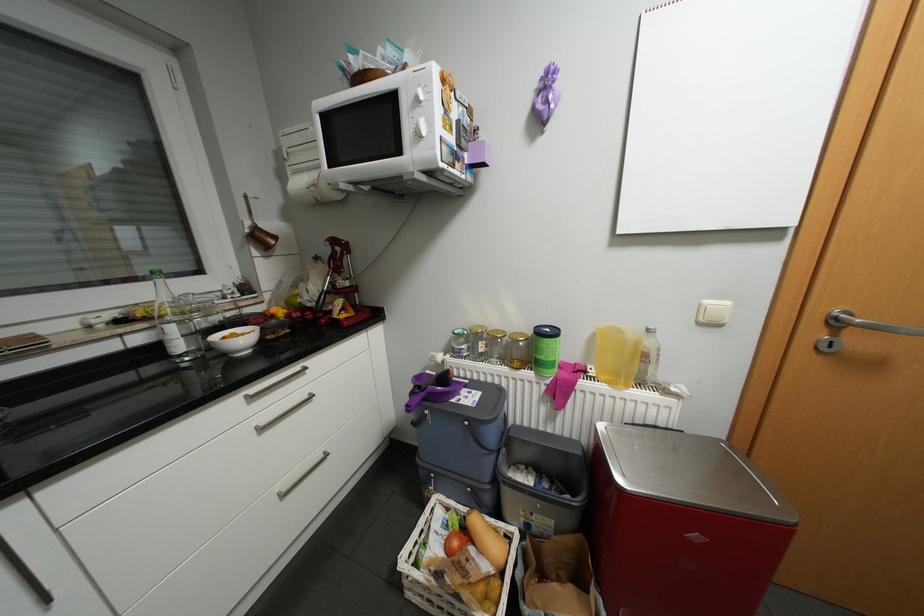
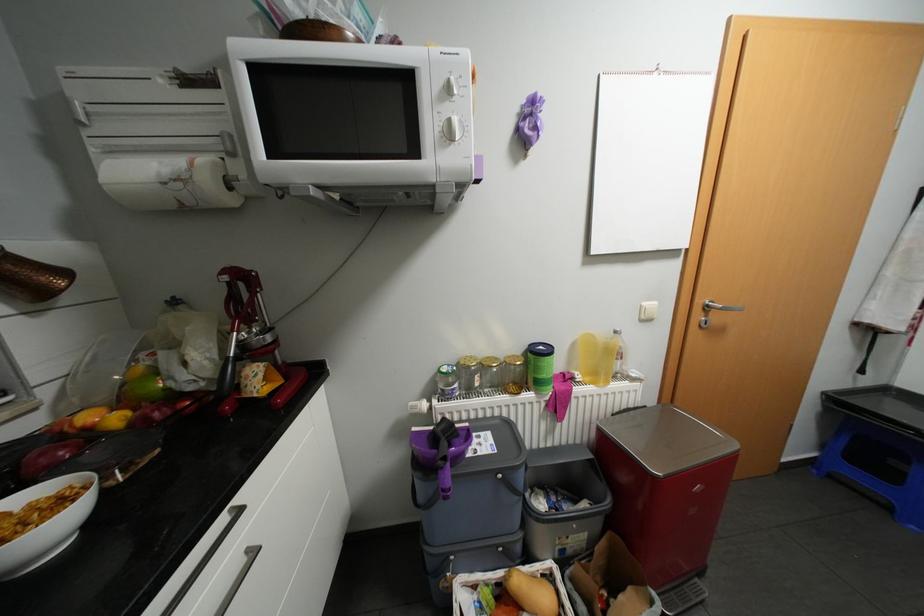
The point at (346, 248) is marked in the first image. Where is the corresponding point in the second image?

(248, 284)